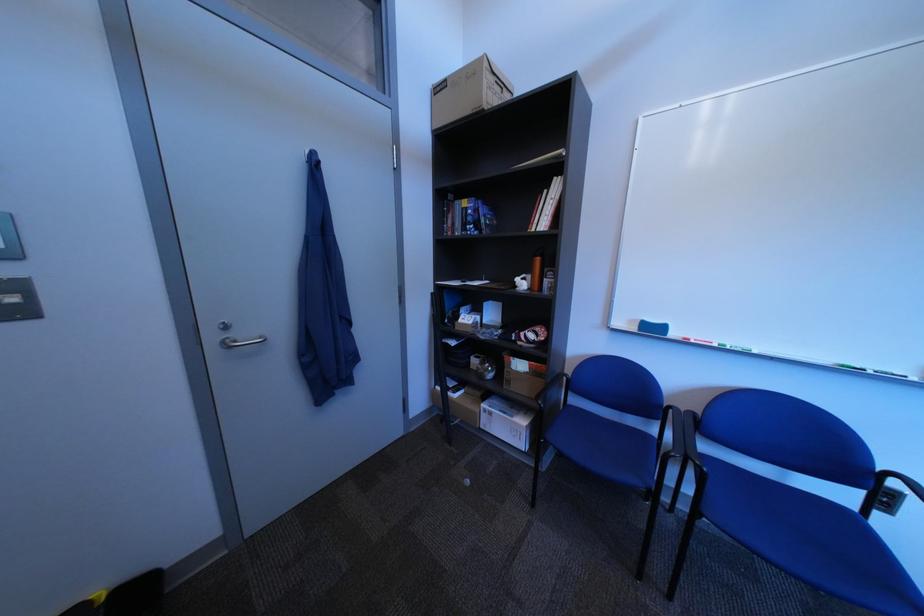
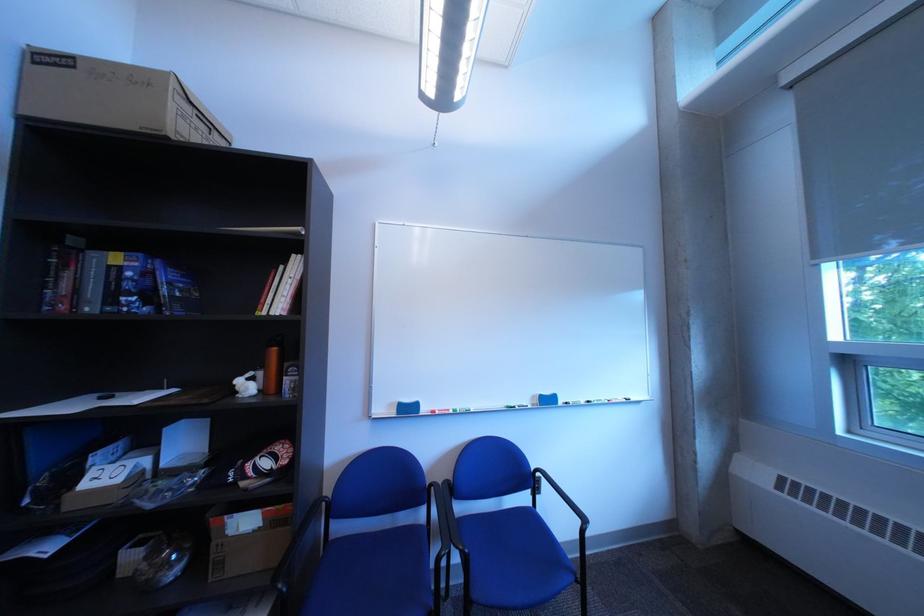
The point at (727,345) is marked in the first image. Where is the corresponding point in the second image?

(465, 411)